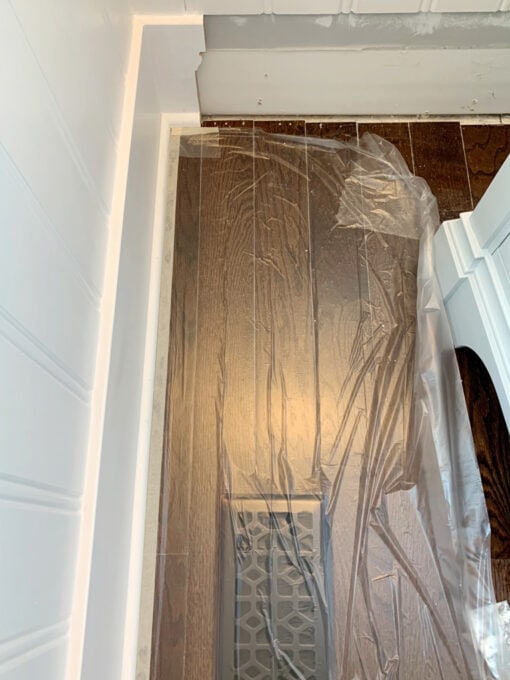
I want to click on nail holes, so [265, 73], [259, 99], [475, 102].